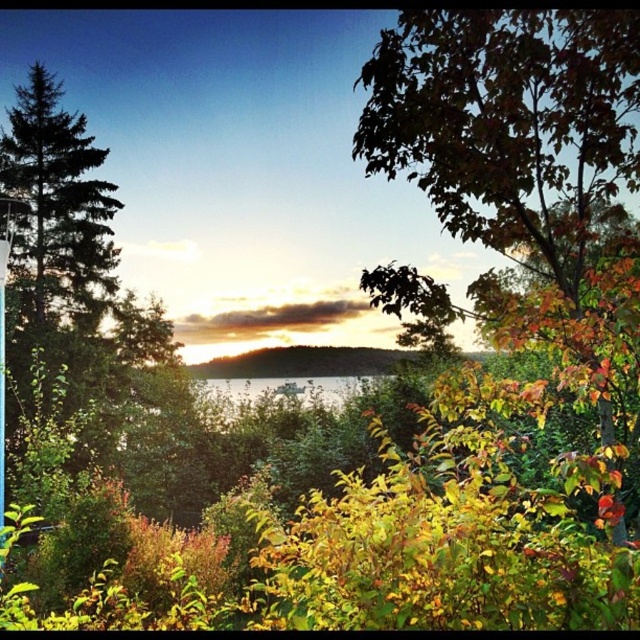
Between autumn leaves at right and clear water at center, which one has more height?

autumn leaves at right is taller.

Describe the element at coordinates (509, 125) in the screenshot. The width and height of the screenshot is (640, 640). I see `autumn leaves at right` at that location.

Does point (611, 154) come farther from viewer compared to point (291, 392)?

No, it is in front of (291, 392).

Image resolution: width=640 pixels, height=640 pixels. Identify the location of autumn leaves at right. (509, 125).